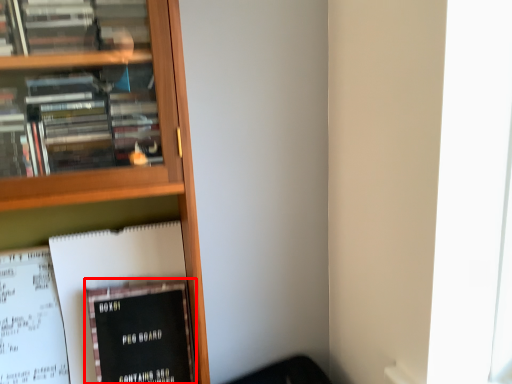
Question: From the image's perspective, what is the correct spatial positioning of book (annotated by the red box) in reference to book?

Choices:
 (A) below
 (B) above

Answer: (A)